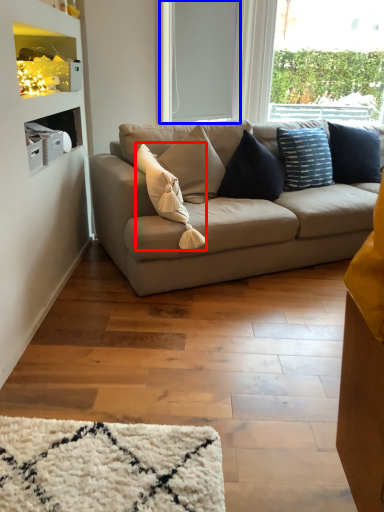
Question: Among these objects, which one is nearest to the camera, pillow (highlighted by a red box) or window screen (highlighted by a blue box)?

Choices:
 (A) pillow
 (B) window screen

Answer: (A)